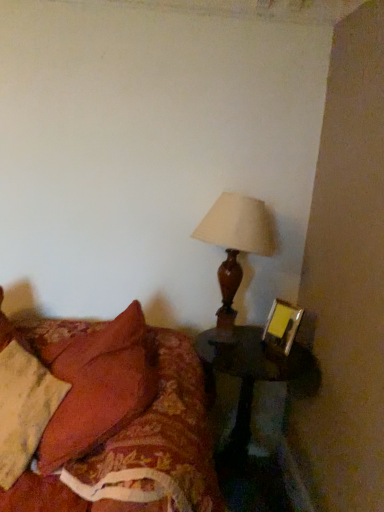
Question: Choose the correct answer: Is velvet red pillow at lower left inside matte gold picture frame at right or outside it?

Choices:
 (A) inside
 (B) outside

Answer: (B)

Question: Visually, is velvet red pillow at lower left positioned to the left or to the right of matte gold picture frame at right?

Choices:
 (A) right
 (B) left

Answer: (B)

Question: Estimate the real-world distances between objects in this image. Which object is farther from the black wood side table at lower right?

Choices:
 (A) floral fabric bed at lower left
 (B) matte gold picture frame at right
 (C) matte brown lamp at upper right
 (D) velvet red pillow at lower left

Answer: (D)

Question: Which of these objects is positioned closest to the matte gold picture frame at right?

Choices:
 (A) black wood side table at lower right
 (B) velvet red pillow at lower left
 (C) matte brown lamp at upper right
 (D) floral fabric bed at lower left

Answer: (A)